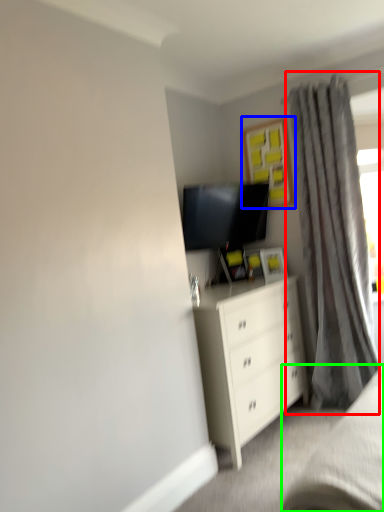
Question: Based on their relative distances, which object is nearer to curtain (highlighted by a red box)? Choose from picture frame (highlighted by a blue box) and bed frame (highlighted by a green box).

Choices:
 (A) picture frame
 (B) bed frame

Answer: (A)